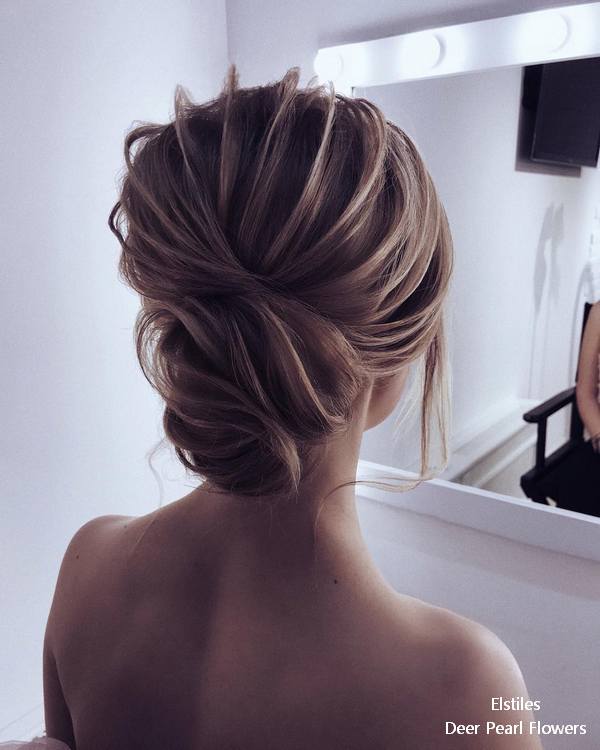
At what (x,y) coordinates should I click in order to perform the action: click on mirror. Please return your answer as a coordinate pair (x, y). The height and width of the screenshot is (750, 600). Looking at the image, I should click on (499, 352).